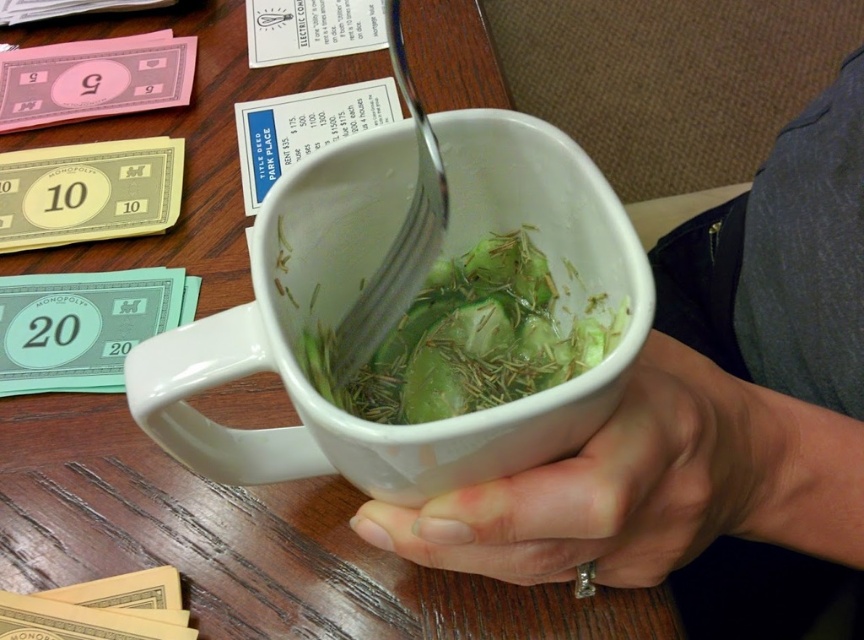
You are playing Monopoly and need to move your token from the satin silver fork at center to the gold paper money at lower left. Which direction should you move your token?

The satin silver fork at center is to the right of the gold paper money at lower left, so you should move your token to the left.

In the scene shown: You are looking at the two points labeled as point (259, 266) and point (99, 291) in the image. Which point is nearer to you?

Point (259, 266) is closer to the viewer than point (99, 291).

You are setting up a small display on a shelf. You have the white ceramic mug at center and the gold paper money at lower left. If you want to arrange them vertically so that the shorter item is at the bottom, which object should you place first?

The gold paper money at lower left is shorter than the white ceramic mug at center, so you should place the gold paper money at lower left first at the bottom.